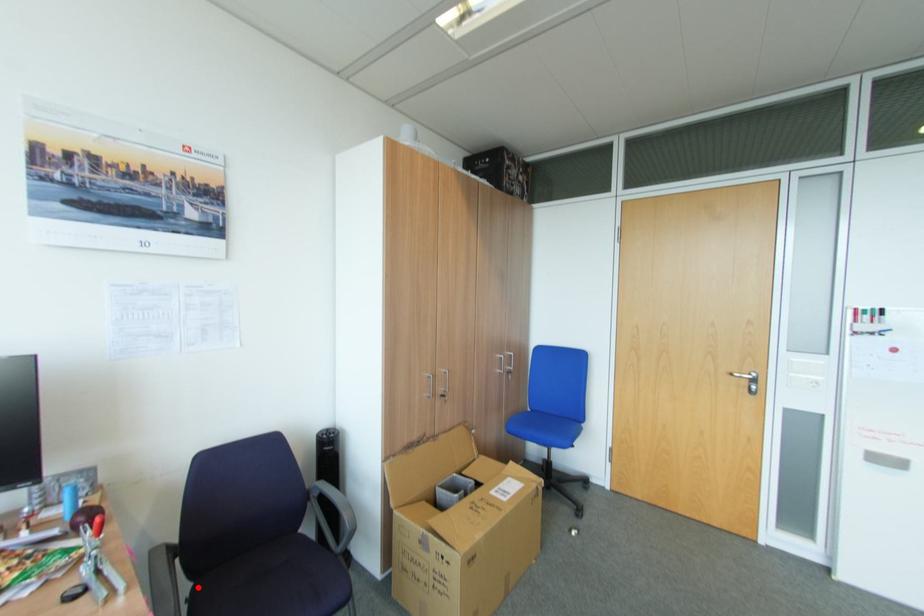
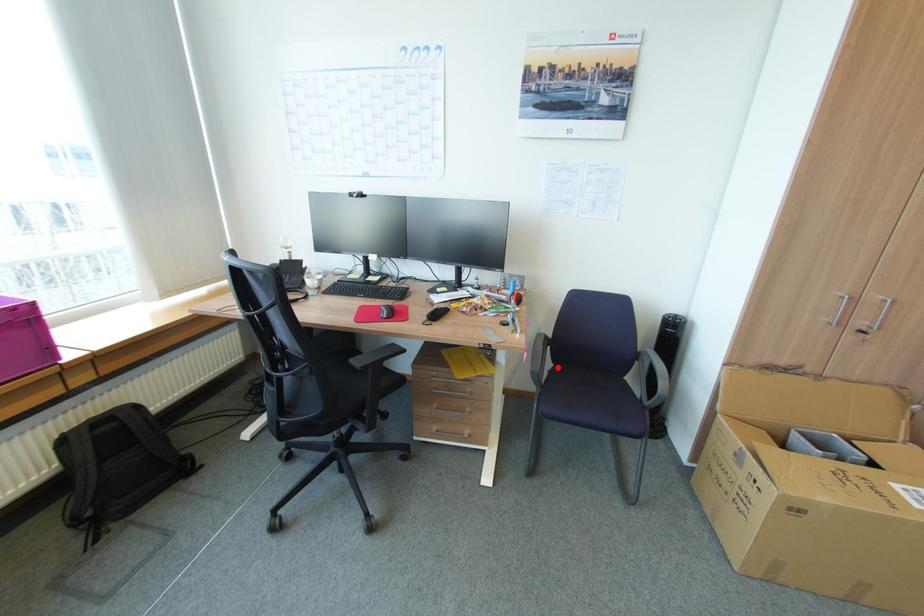
I am providing you with two images of the same scene from different viewpoints. A red point is marked on the first image and another point is marked on the second image. Does the point marked in image1 correspond to the same location as the one in image2?

Yes